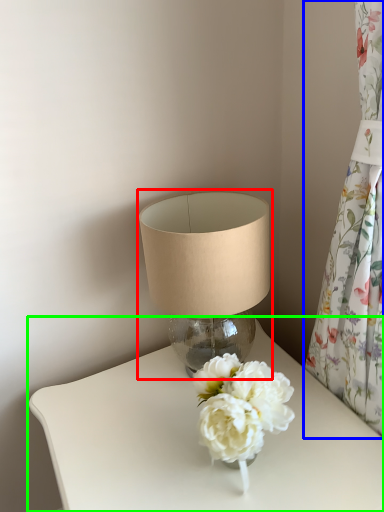
Question: Which is nearer to the lamp (highlighted by a red box)? curtain (highlighted by a blue box) or table (highlighted by a green box).

Choices:
 (A) curtain
 (B) table

Answer: (B)